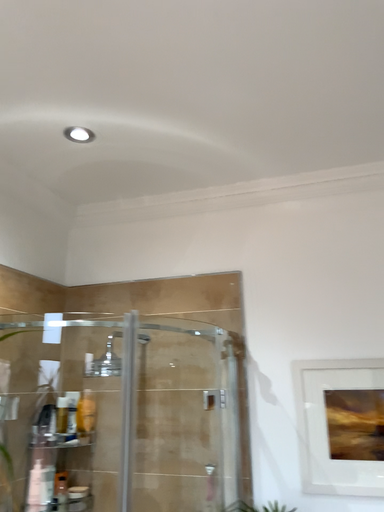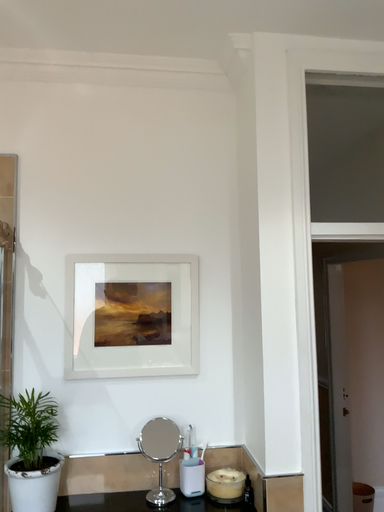
Question: How did the camera likely rotate when shooting the video?

Choices:
 (A) rotated downward
 (B) rotated upward

Answer: (A)